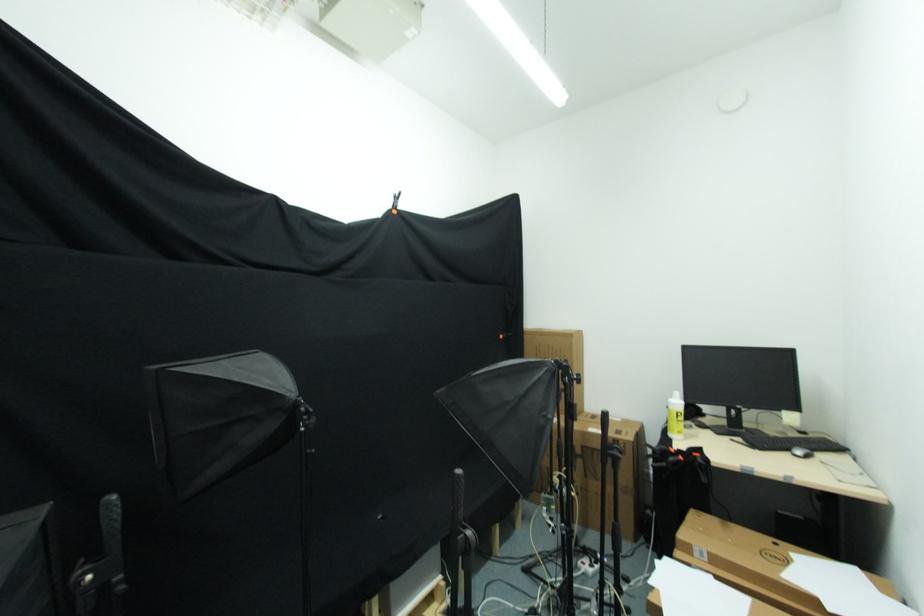
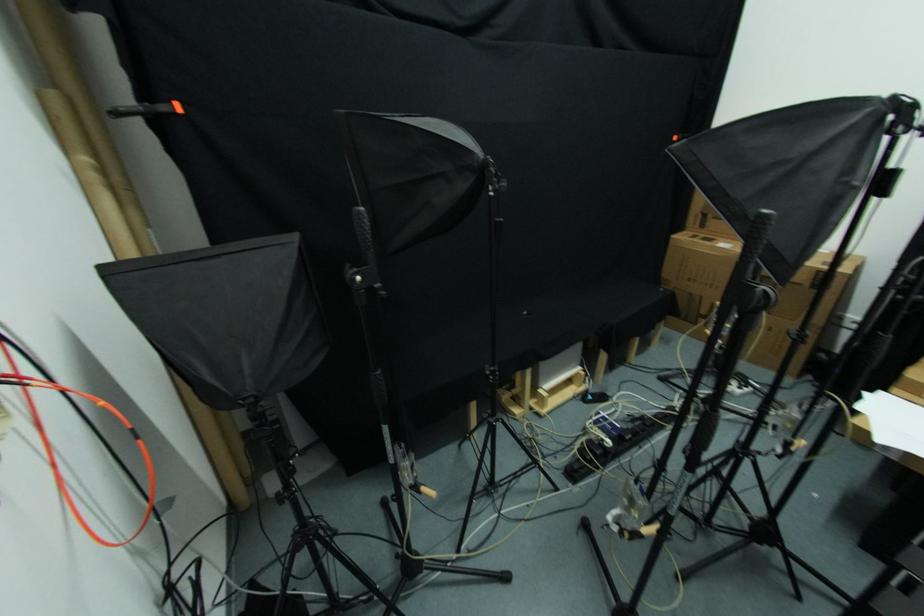
Based on the continuous images, in which direction is the camera rotating?

The camera rotated toward left-down.